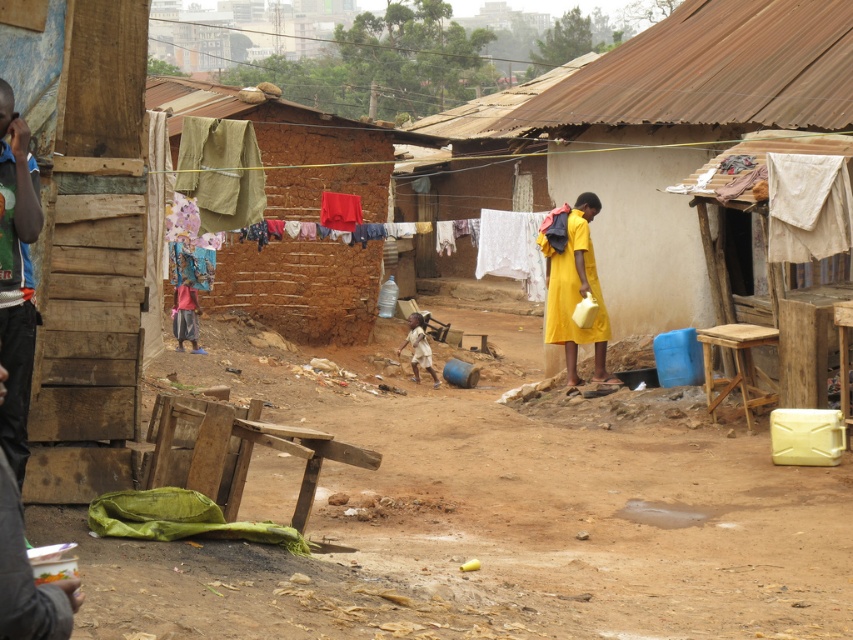
Does wooden planks at left appear under green jersey at left?

Actually, wooden planks at left is above green jersey at left.

Who is more distant from viewer, (x=45, y=445) or (x=32, y=168)?

The point (x=45, y=445) is behind.

Who is more forward, (94, 145) or (27, 282)?

Positioned in front is point (27, 282).

The height and width of the screenshot is (640, 853). What are the coordinates of `wooden planks at left` in the screenshot? It's located at 83,236.

Is brown dirt field at center to the left of green jersey at left from the viewer's perspective?

Incorrect, brown dirt field at center is not on the left side of green jersey at left.

Does brown dirt field at center have a greater width compared to green jersey at left?

Yes.

Where is `brown dirt field at center`? brown dirt field at center is located at coordinates (497, 522).

Can you confirm if brown dirt field at center is positioned to the left of yellow matte dress at center?

Indeed, brown dirt field at center is positioned on the left side of yellow matte dress at center.

Can you confirm if brown dirt field at center is shorter than yellow matte dress at center?

Yes.

Between point (505, 481) and point (567, 276), which one is positioned in front?

Point (505, 481) is in front.

Locate an element on the screen. The image size is (853, 640). brown dirt field at center is located at coordinates (497, 522).